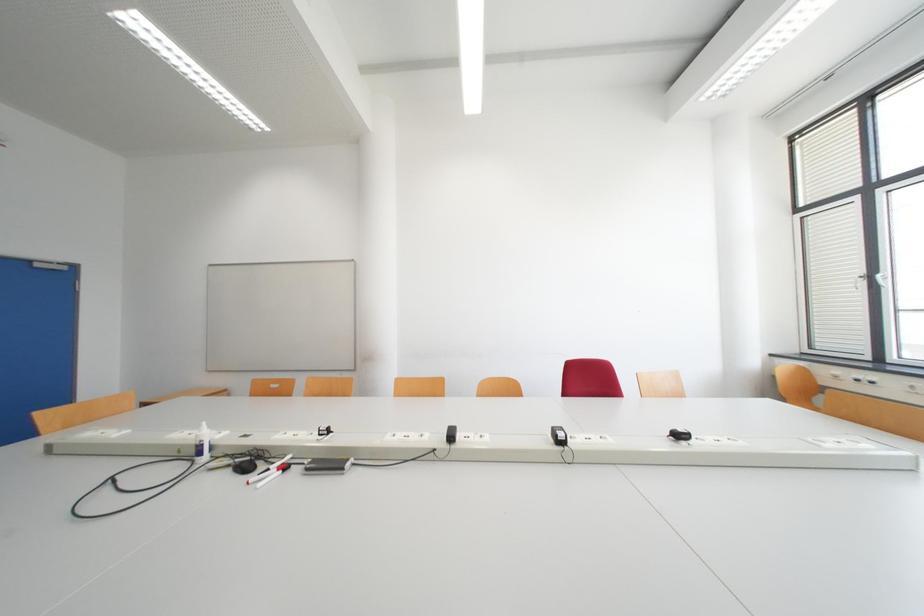
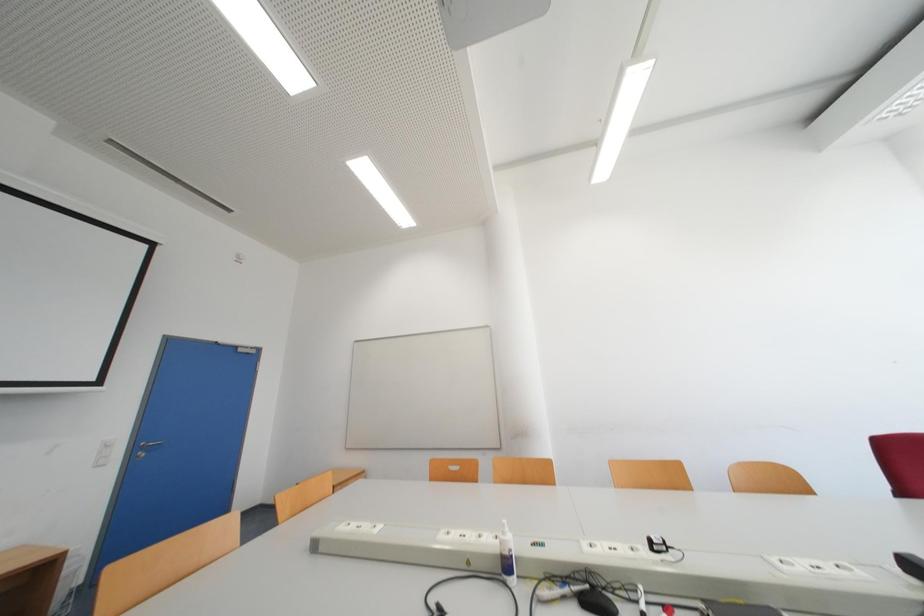
Question: What movement of the cameraman would produce the second image?

Choices:
 (A) Left
 (B) Right
 (C) Forward
 (D) Backward

Answer: (A)